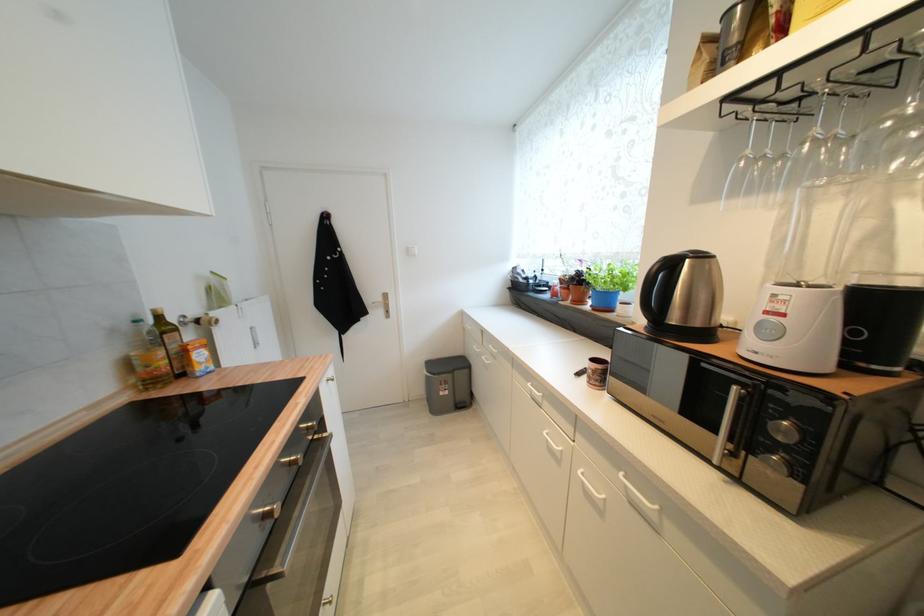
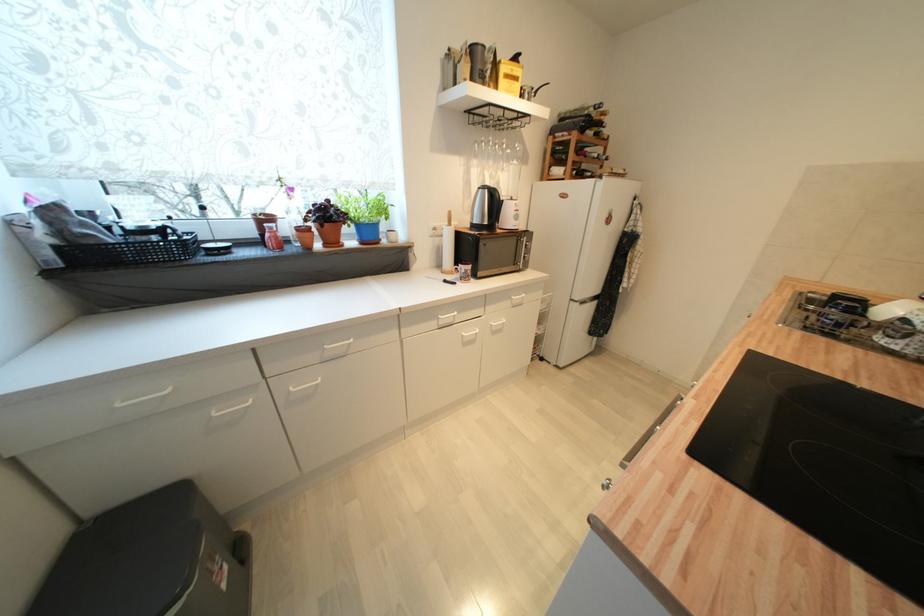
The point at [446,395] is marked in the first image. Where is the corresponding point in the second image?

(228, 588)